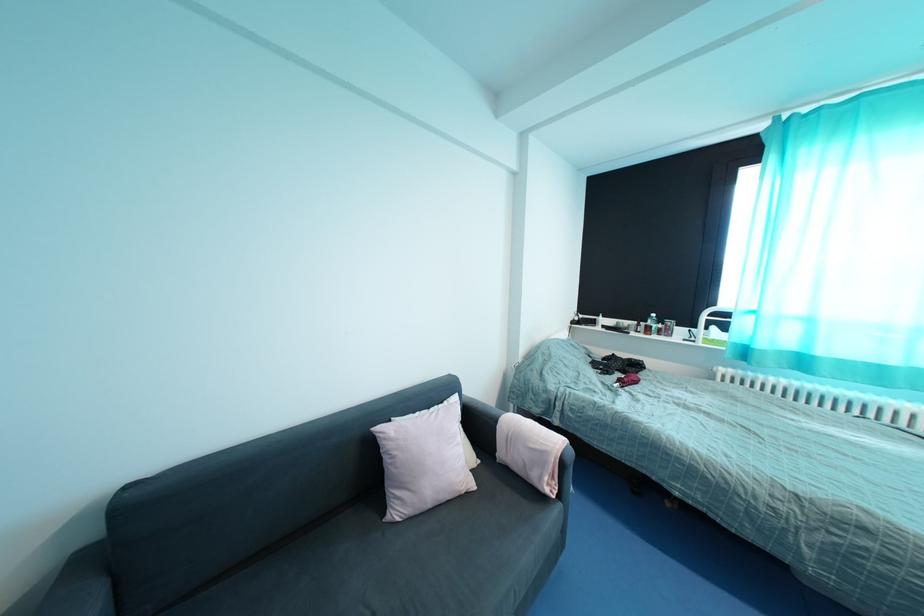
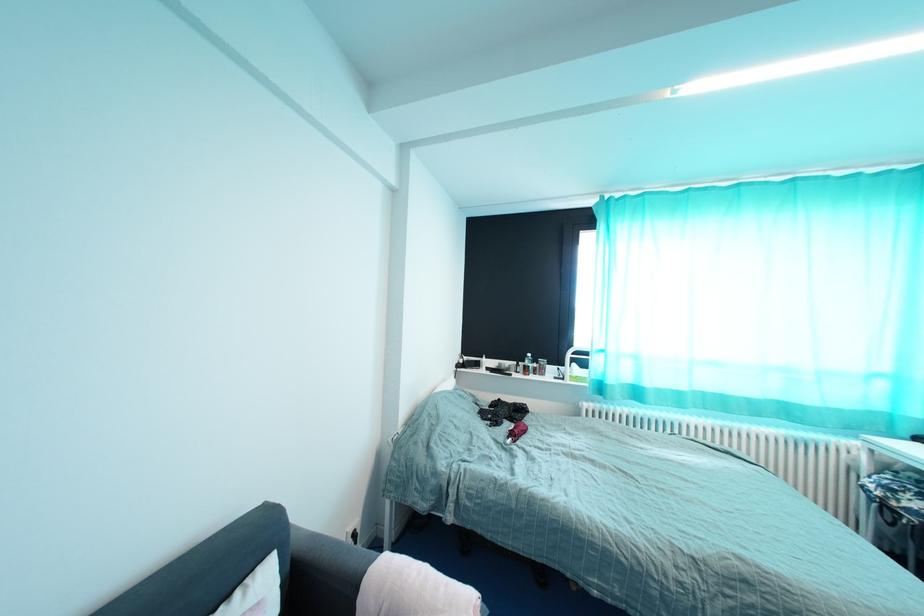
Question: In a continuous first-person perspective shot, in which direction is the camera moving?

Choices:
 (A) Left
 (B) Right
 (C) Forward
 (D) Backward

Answer: (C)